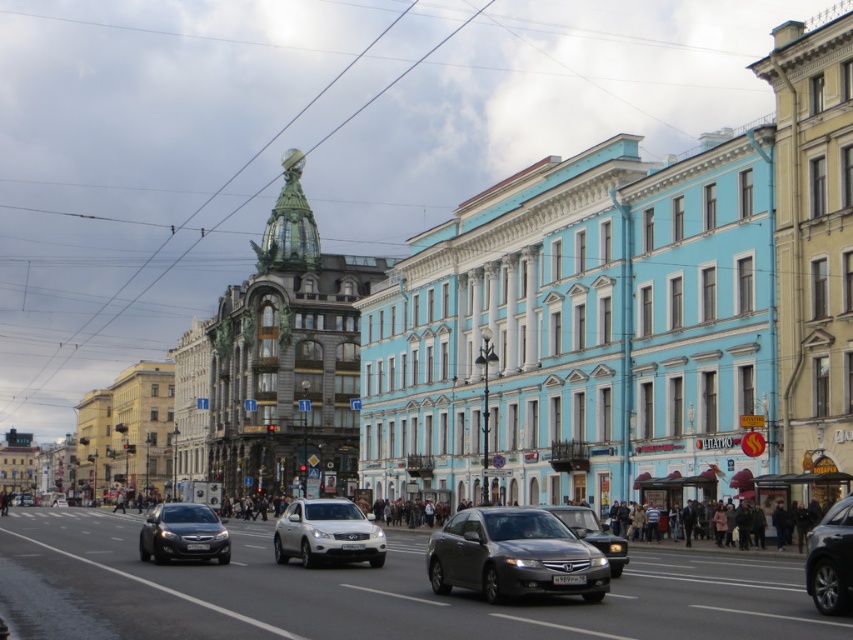
Is point (461, 515) positioned behind point (155, 508)?

No.

Which is below, metallic gray sedan at center or shiny black sedan at center?

shiny black sedan at center is below.

I want to click on metallic gray sedan at center, so (x=514, y=556).

Locate an element on the screen. This screenshot has height=640, width=853. metallic gray sedan at center is located at coordinates (514, 556).

Does shiny black sedan at center have a greater width compared to shiny black car at lower right?

No, shiny black sedan at center is not wider than shiny black car at lower right.

Can you confirm if shiny black sedan at center is positioned above shiny black car at lower right?

No.

Locate an element on the screen. shiny black sedan at center is located at coordinates (183, 532).

Locate an element on the screen. This screenshot has height=640, width=853. shiny black sedan at center is located at coordinates (183, 532).

Does satin silver suv at center have a lesser width compared to shiny silver sedan at center?

No, satin silver suv at center is not thinner than shiny silver sedan at center.

Does satin silver suv at center have a greater height compared to shiny silver sedan at center?

No, satin silver suv at center is not taller than shiny silver sedan at center.

Is point (358, 529) positioned before point (581, 529)?

No, it is behind (581, 529).

You are a GUI agent. You are given a task and a screenshot of the screen. Output one action in this format:
    pyautogui.click(x=<x>, y=<y>)
    Task: Click on the satin silver suv at center
    
    Given the screenshot: What is the action you would take?
    point(328,532)